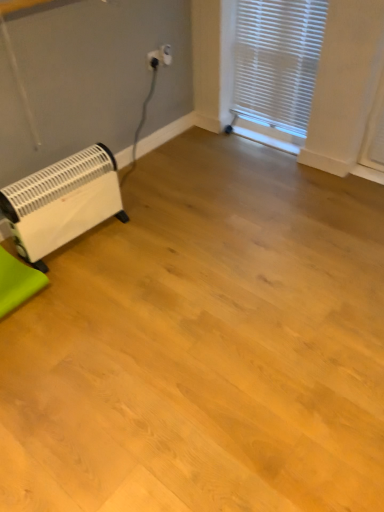
Identify the location of free location to the right of green fabric at lower left. The height and width of the screenshot is (512, 384). (85, 291).